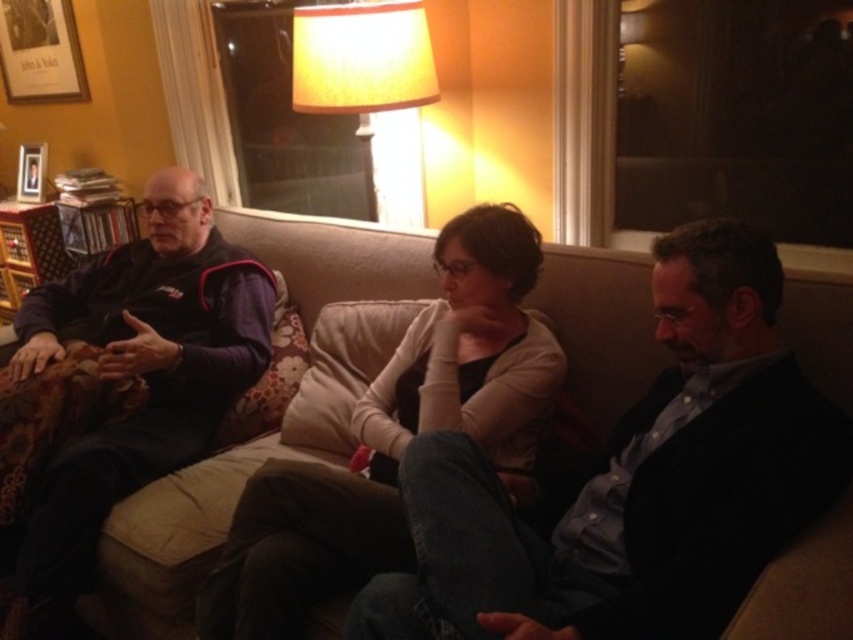
Question: Does dark blue fleece jacket at left appear over yellow fabric lampshade at upper center?

Choices:
 (A) yes
 (B) no

Answer: (B)

Question: Based on their relative distances, which object is farther from the wooden picture frame at upper left?

Choices:
 (A) light beige couch cushion at center
 (B) dark blue fleece jacket at left
 (C) yellow fabric lampshade at upper center
 (D) beige fabric couch at center

Answer: (A)

Question: Is light beige couch cushion at center wider than yellow fabric lampshade at upper center?

Choices:
 (A) no
 (B) yes

Answer: (B)

Question: Which point is closer to the camera taking this photo?

Choices:
 (A) (303, 240)
 (B) (372, 51)

Answer: (B)

Question: Which object is closer to the camera taking this photo?

Choices:
 (A) wooden picture frame at upper left
 (B) dark blue fleece jacket at left
 (C) yellow fabric lampshade at upper center
 (D) light beige couch cushion at center

Answer: (D)

Question: Is the position of beige fabric couch at center less distant than that of dark blue fleece jacket at left?

Choices:
 (A) no
 (B) yes

Answer: (B)